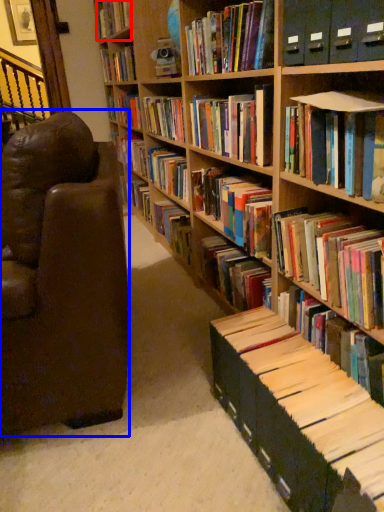
Question: Which point is closer to the camera, book (highlighted by a red box) or chair (highlighted by a blue box)?

Choices:
 (A) book
 (B) chair

Answer: (B)